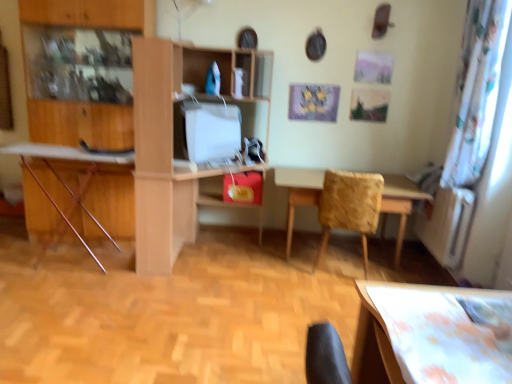
Find the location of a particular element. vacant area to the right of wooden ironing board at left is located at coordinates [x=144, y=287].